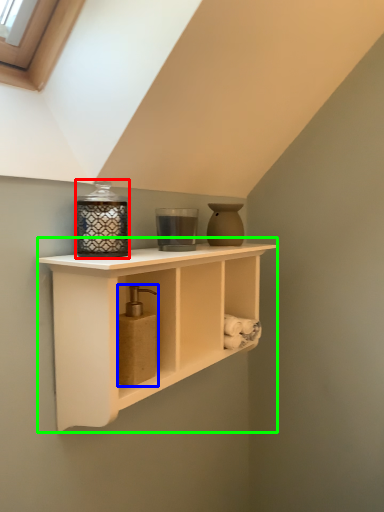
Question: Estimate the real-world distances between objects in this image. Which object is closer to candle holder (highlighted by a red box), soap dispenser (highlighted by a blue box) or shelf (highlighted by a green box)?

Choices:
 (A) soap dispenser
 (B) shelf

Answer: (A)